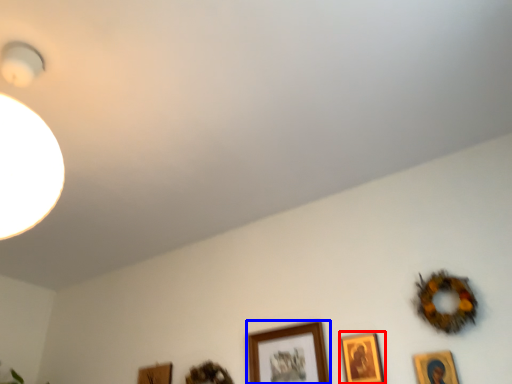
Question: Among these objects, which one is nearest to the camera, picture frame (highlighted by a red box) or picture frame (highlighted by a blue box)?

Choices:
 (A) picture frame
 (B) picture frame

Answer: (A)